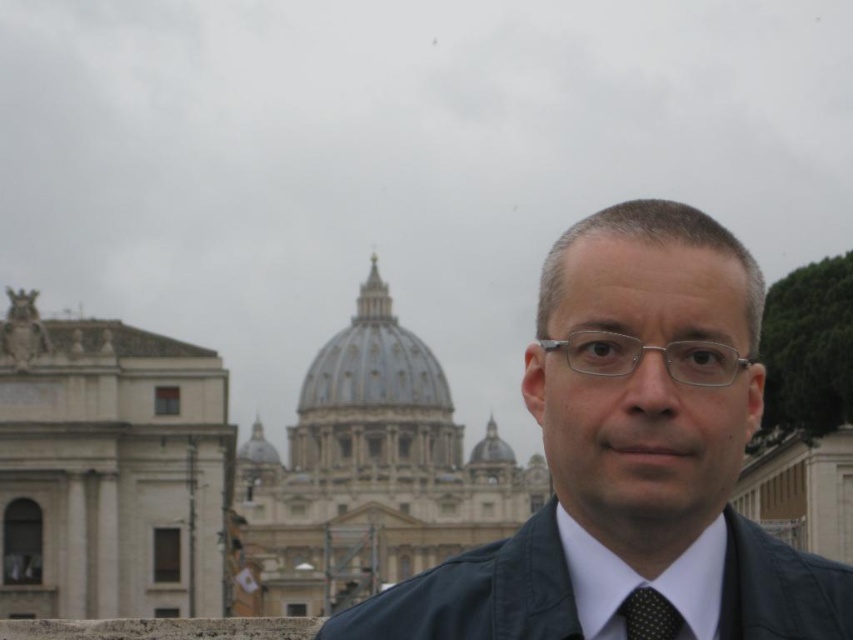
Can you confirm if matte black jacket at center is thinner than black dotted fabric tie at center?

In fact, matte black jacket at center might be wider than black dotted fabric tie at center.

Which is above, matte black jacket at center or black dotted fabric tie at center?

black dotted fabric tie at center is above.

Describe the element at coordinates (631, 458) in the screenshot. This screenshot has width=853, height=640. I see `matte black jacket at center` at that location.

This screenshot has width=853, height=640. I want to click on matte black jacket at center, so click(631, 458).

Does matte black jacket at center appear under silver metallic glasses at center?

Indeed, matte black jacket at center is positioned under silver metallic glasses at center.

Is matte black jacket at center positioned behind silver metallic glasses at center?

That is False.

Does point (639, 568) lie in front of point (587, 372)?

Yes.

You are a GUI agent. You are given a task and a screenshot of the screen. Output one action in this format:
    pyautogui.click(x=<x>, y=<y>)
    Task: Click on the matte black jacket at center
    The width and height of the screenshot is (853, 640).
    Given the screenshot: What is the action you would take?
    pyautogui.click(x=631, y=458)

Is white smooth dress shirt at center to the left of black dotted fabric tie at center from the viewer's perspective?

Incorrect, white smooth dress shirt at center is not on the left side of black dotted fabric tie at center.

Who is more distant from viewer, (x=606, y=568) or (x=671, y=636)?

The point (x=606, y=568) is behind.

Who is more distant from viewer, [637,586] or [643,616]?

The point [637,586] is behind.

This screenshot has height=640, width=853. I want to click on white smooth dress shirt at center, so click(643, 580).